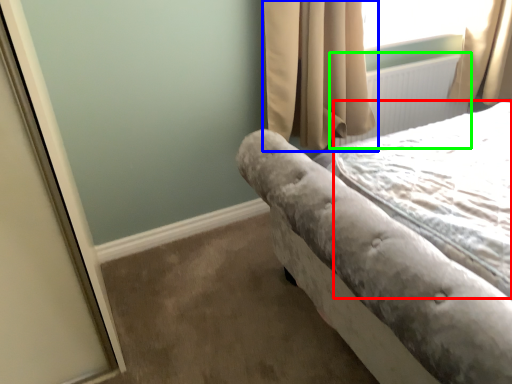
Question: Based on their relative distances, which object is nearer to sheet (highlighted by a red box)? Choose from curtain (highlighted by a blue box) and radiator (highlighted by a green box).

Choices:
 (A) curtain
 (B) radiator

Answer: (A)